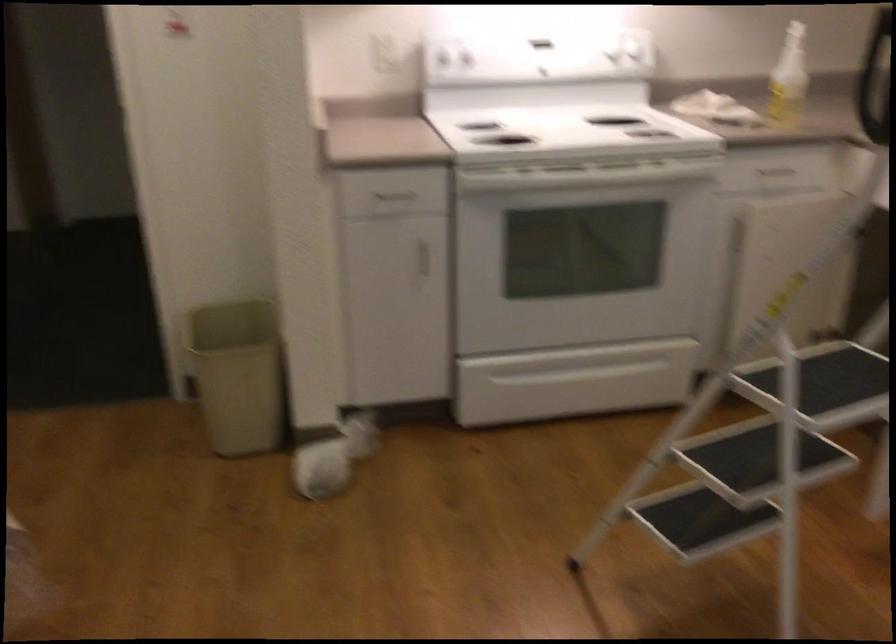
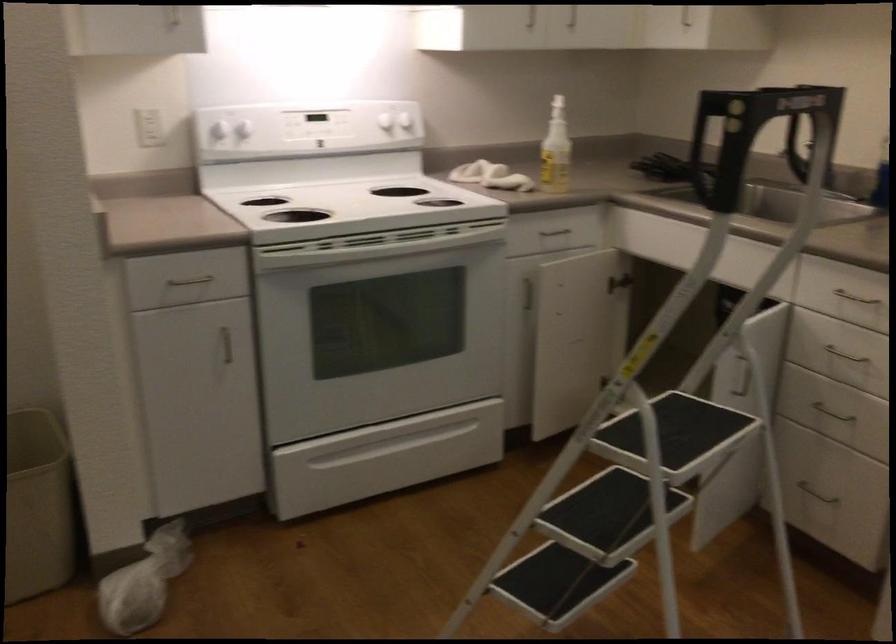
Locate, in the second image, the point that corresponds to [819,375] in the first image.

(676, 429)